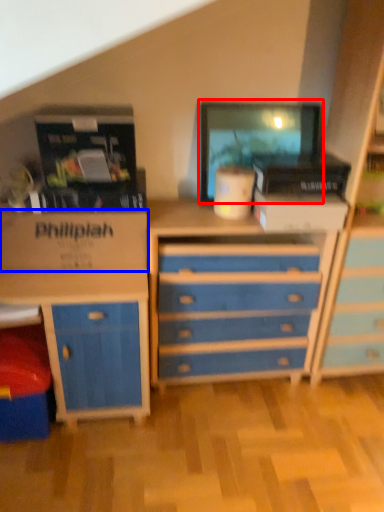
Question: Which object appears closest to the camera in this image, computer monitor (highlighted by a red box) or cardboard box (highlighted by a blue box)?

Choices:
 (A) computer monitor
 (B) cardboard box

Answer: (B)